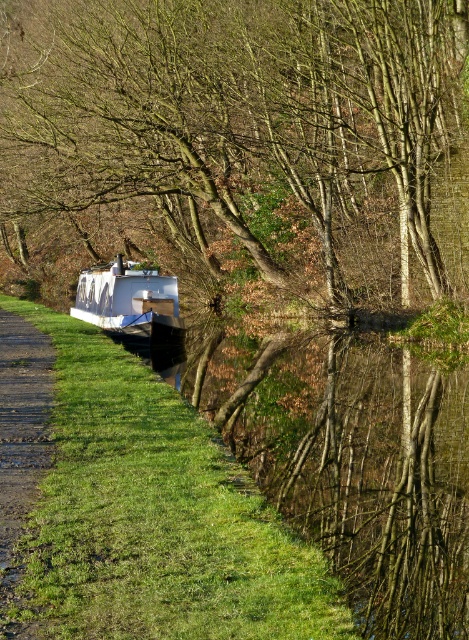
Does brown leafy tree at upper center appear over white matte boat at center?

Correct, brown leafy tree at upper center is located above white matte boat at center.

Is brown leafy tree at upper center below white matte boat at center?

Actually, brown leafy tree at upper center is above white matte boat at center.

Which is in front, point (401, 204) or point (100, 326)?

Point (100, 326) is more forward.

I want to click on brown leafy tree at upper center, so click(x=242, y=138).

Can you confirm if gravel path at lower left is shorter than white matte boat at center?

Correct, gravel path at lower left is not as tall as white matte boat at center.

Looking at this image, does gravel path at lower left have a greater height compared to white matte boat at center?

No, gravel path at lower left is not taller than white matte boat at center.

Where is `gravel path at lower left`? gravel path at lower left is located at coordinates (22, 428).

Who is more forward, (119,161) or (17,417)?

Point (17,417)

Between point (188, 212) and point (7, 580), which one is positioned behind?

Positioned behind is point (188, 212).

The width and height of the screenshot is (469, 640). What are the coordinates of `brown leafy tree at upper center` in the screenshot? It's located at (242, 138).